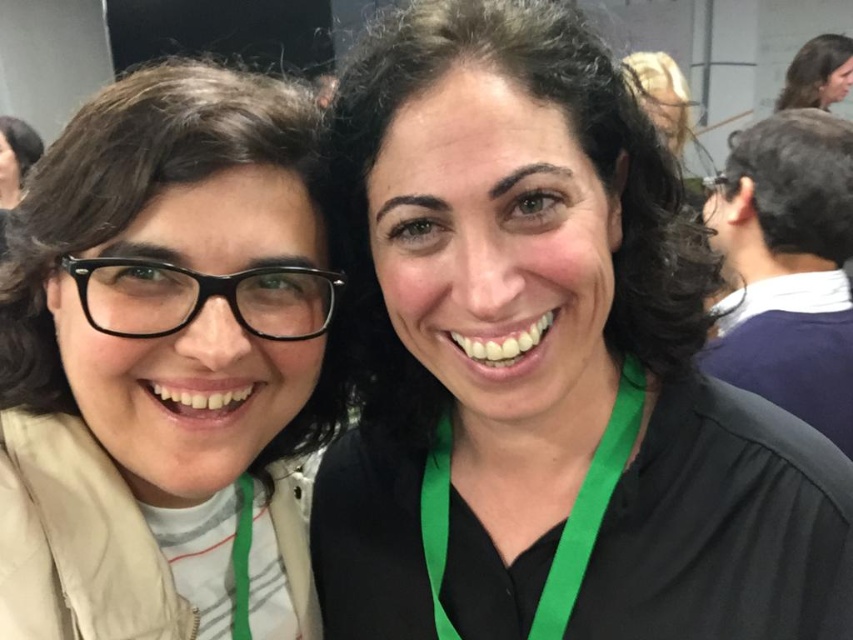
Does matte black glasses at left appear on the left side of green fabric lanyard at center?

Correct, you'll find matte black glasses at left to the left of green fabric lanyard at center.

Is matte black glasses at left positioned behind green fabric lanyard at center?

That is False.

Where is `matte black glasses at left`? matte black glasses at left is located at coordinates (166, 364).

Identify the location of matte black glasses at left. This screenshot has width=853, height=640. (166, 364).

Can you confirm if black matte shirt at center is shorter than green fabric lanyard at center?

No.

Is black matte shirt at center to the right of green fabric lanyard at center from the viewer's perspective?

Yes, black matte shirt at center is to the right of green fabric lanyard at center.

At what (x,y) coordinates should I click in order to perform the action: click on black matte shirt at center. Please return your answer as a coordinate pair (x, y). This screenshot has height=640, width=853. Looking at the image, I should click on (546, 364).

Does black matte shirt at center appear over matte black glasses at left?

Yes.

Is the position of black matte shirt at center more distant than that of matte black glasses at left?

No, black matte shirt at center is in front of matte black glasses at left.

Does point (351, 184) come behind point (67, 465)?

No, it is not.

Find the location of a particular element. The height and width of the screenshot is (640, 853). black matte shirt at center is located at coordinates (546, 364).